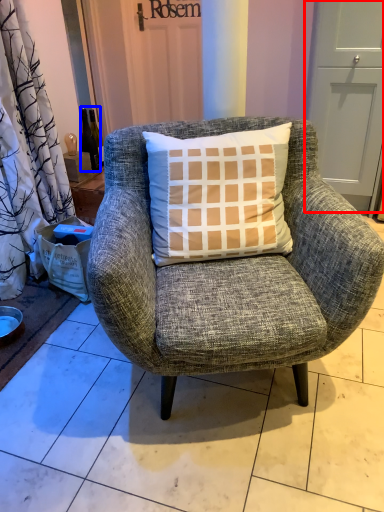
Question: Which of the following is the farthest to the observer, screen door (highlighted by a red box) or bottle (highlighted by a blue box)?

Choices:
 (A) screen door
 (B) bottle

Answer: (B)